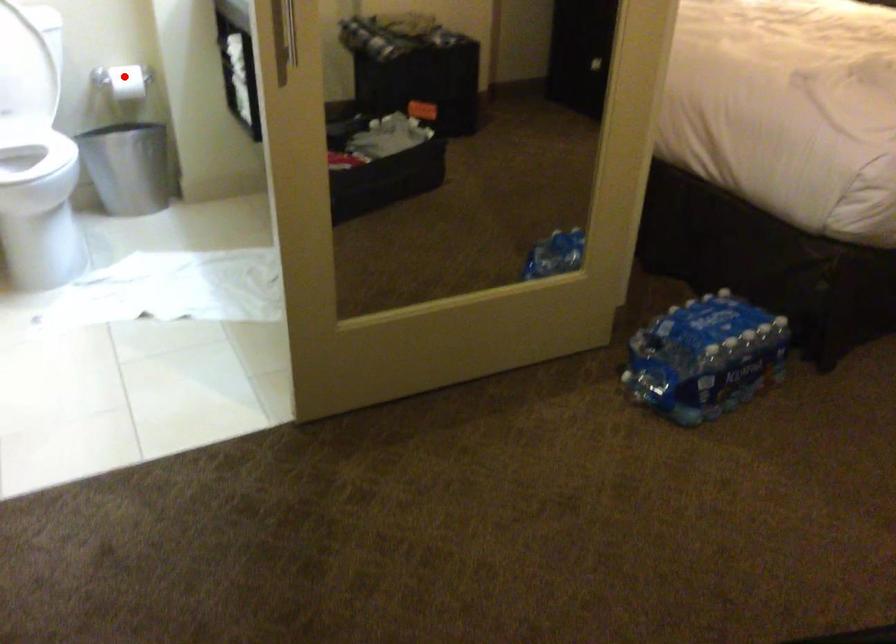
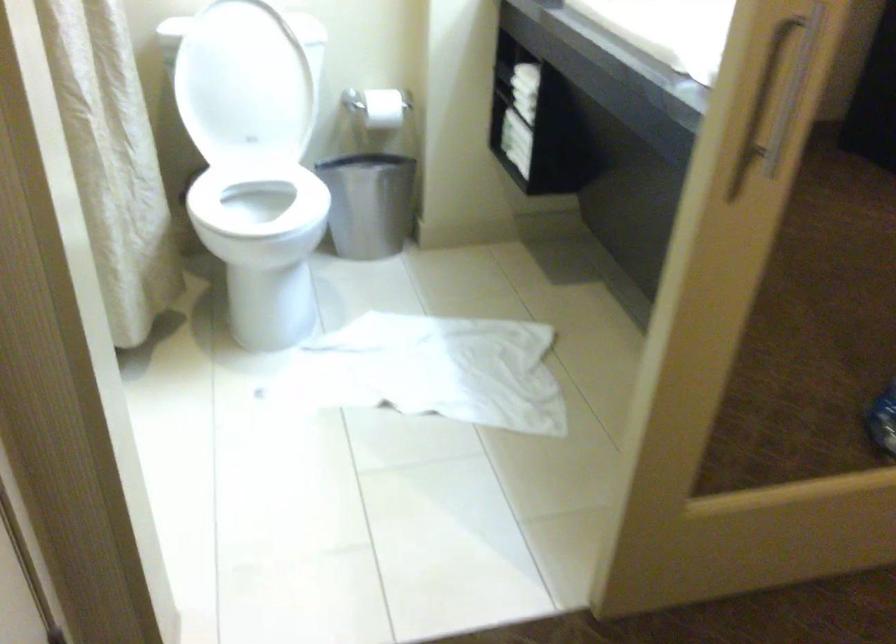
Question: I am providing you with two images of the same scene from different viewpoints. Image1 has a red point marked. In image2, the corresponding 3D location appears at what relative position? Reply with the corresponding letter.

Choices:
 (A) Closer
 (B) Farther

Answer: (A)